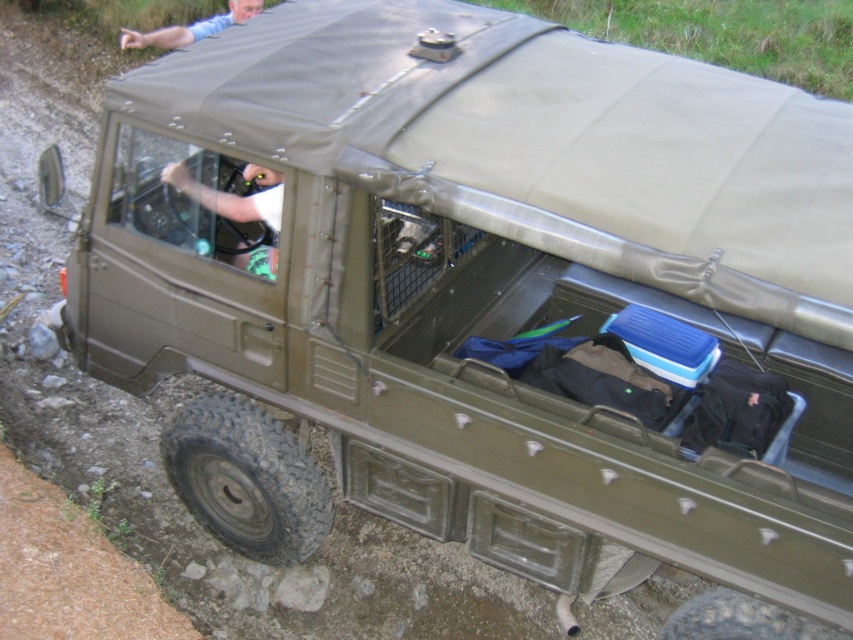
You are a passenger in the rugged, olive green off road vehicle and you see the white fabric shirt at center and the blue denim jeans at upper center. Which item is positioned more to the right side of the vehicle?

The white fabric shirt at center is positioned more to the right side of the vehicle compared to the blue denim jeans at upper center.

You are a photographer positioned at the camera location. You want to take a photo of the rugged, olive green off road vehicle. Which of the two points, point (273, 246) or point (158, 40), is closer to your current position?

Point (273, 246) is closer to the camera than point (158, 40), so it is the closer point.